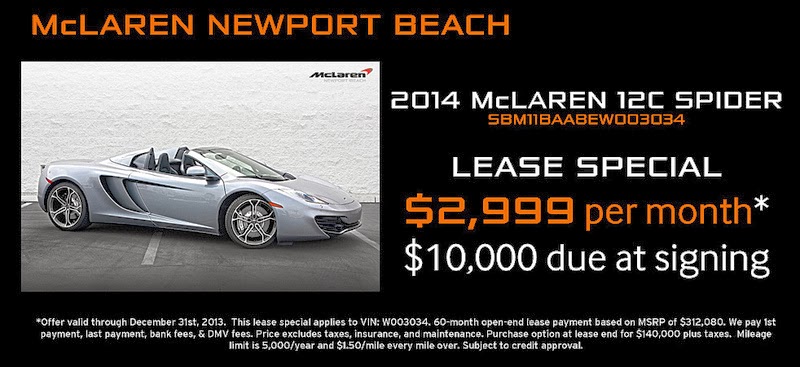
Find the location of a particular element. The height and width of the screenshot is (367, 800). concrete white wall is located at coordinates (206, 100).